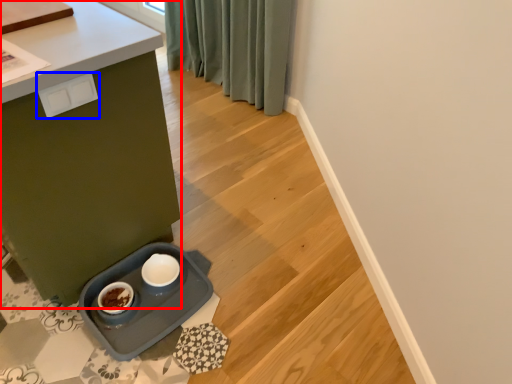
Question: Among these objects, which one is nearest to the camera, table (highlighted by a red box) or drawer (highlighted by a blue box)?

Choices:
 (A) table
 (B) drawer

Answer: (A)